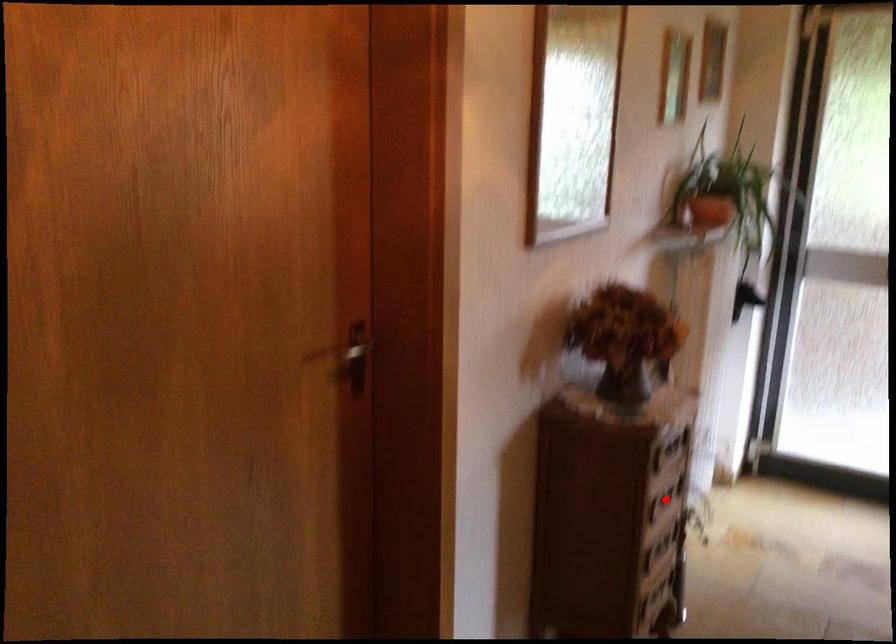
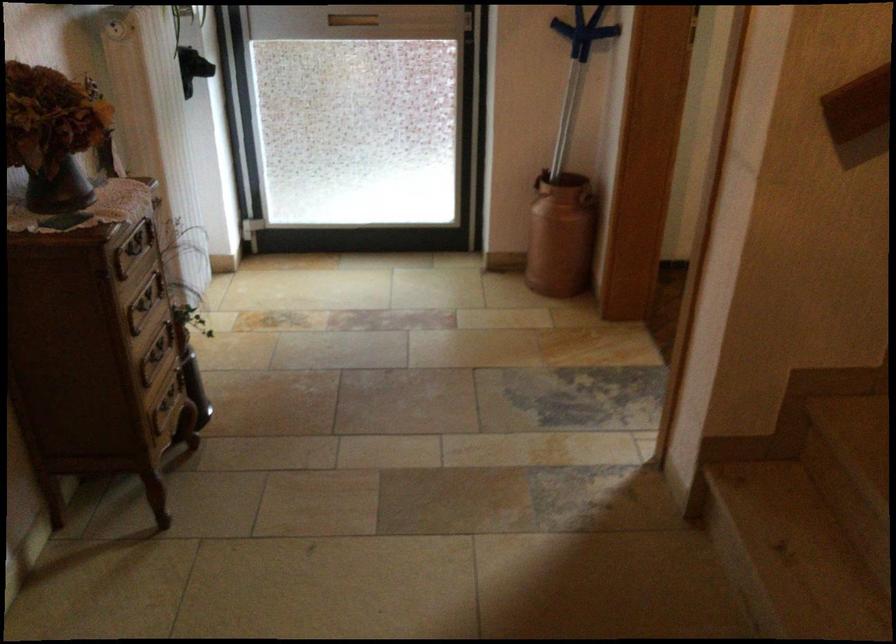
Where in the second image is the point corresponding to the highlighted location from the first image?

(144, 303)